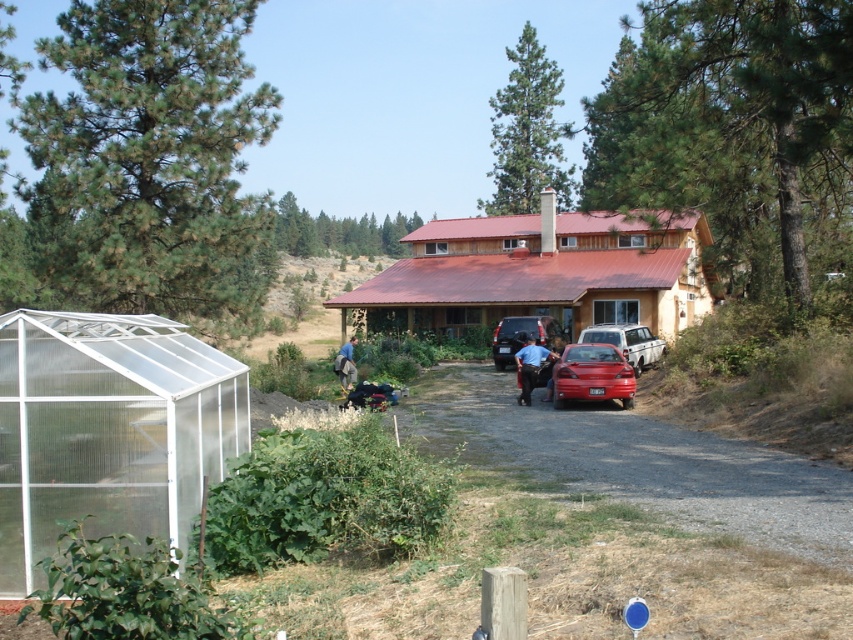
Can you confirm if red gravel driveway at center is positioned above matte red sedan at center?

No, red gravel driveway at center is not above matte red sedan at center.

Is red gravel driveway at center closer to the viewer compared to matte red sedan at center?

Yes.

Is point (527, 444) less distant than point (619, 332)?

Yes, point (527, 444) is in front of point (619, 332).

Find the location of a particular element. red gravel driveway at center is located at coordinates (641, 461).

Is point (352, 230) farther from camera compared to point (618, 384)?

Yes, point (352, 230) is farther from viewer.

Is green matte pine at upper center taller than shiny red sedan at center?

Yes, green matte pine at upper center is taller than shiny red sedan at center.

The height and width of the screenshot is (640, 853). What are the coordinates of `green matte pine at upper center` in the screenshot? It's located at (338, 230).

Based on the photo, is green textured pine at left above red gravel driveway at center?

Yes, green textured pine at left is above red gravel driveway at center.

The width and height of the screenshot is (853, 640). I want to click on green textured pine at left, so click(144, 164).